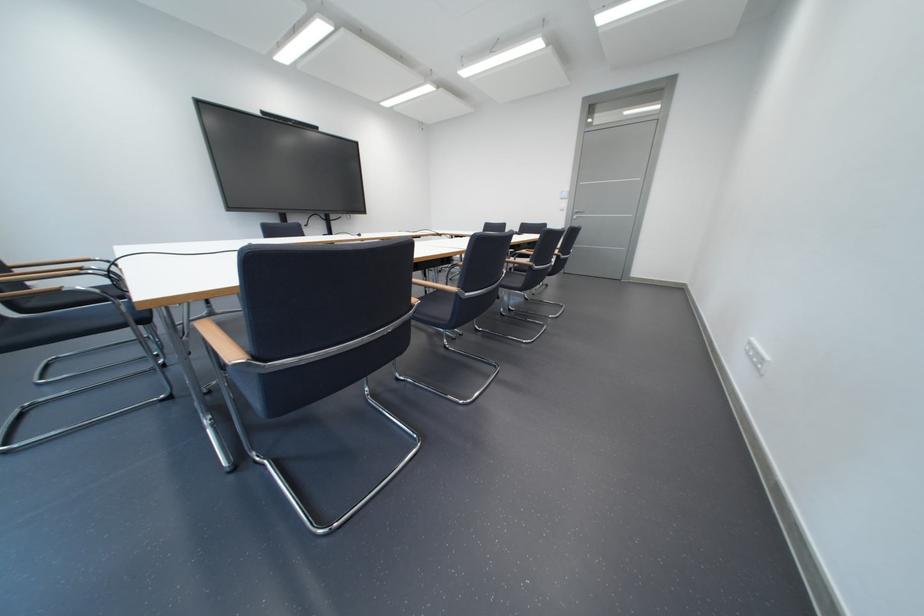
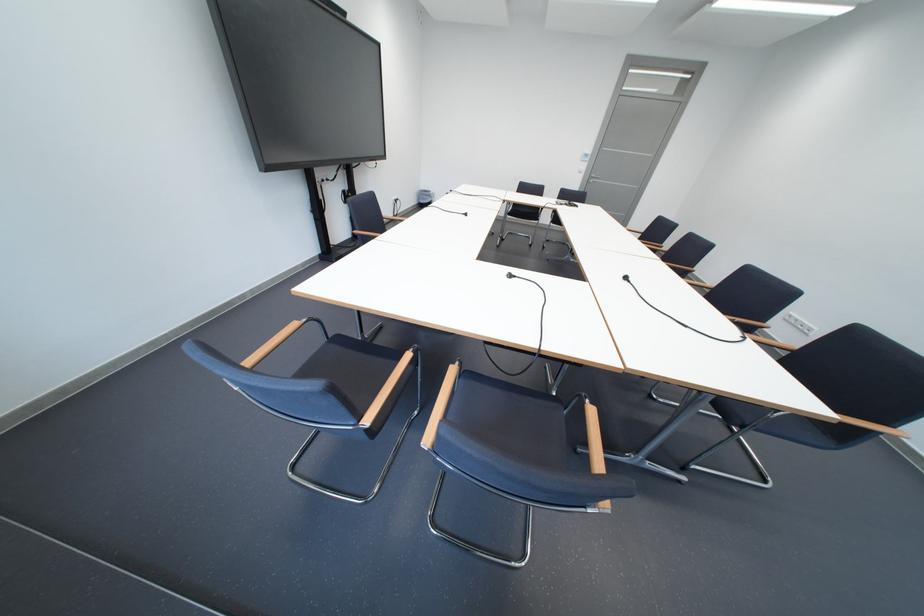
In the second image, find the point that corresponds to point 577,206 in the first image.

(596, 168)